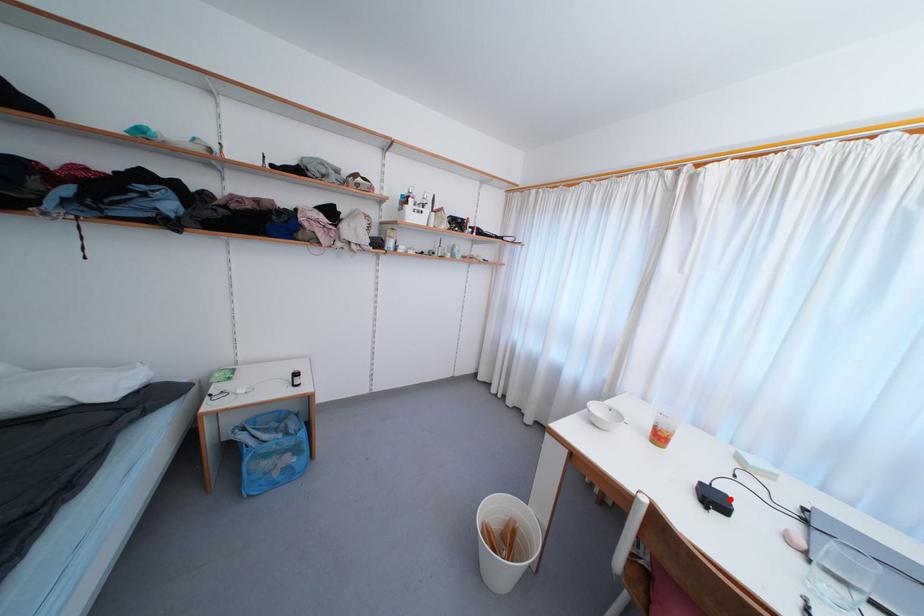
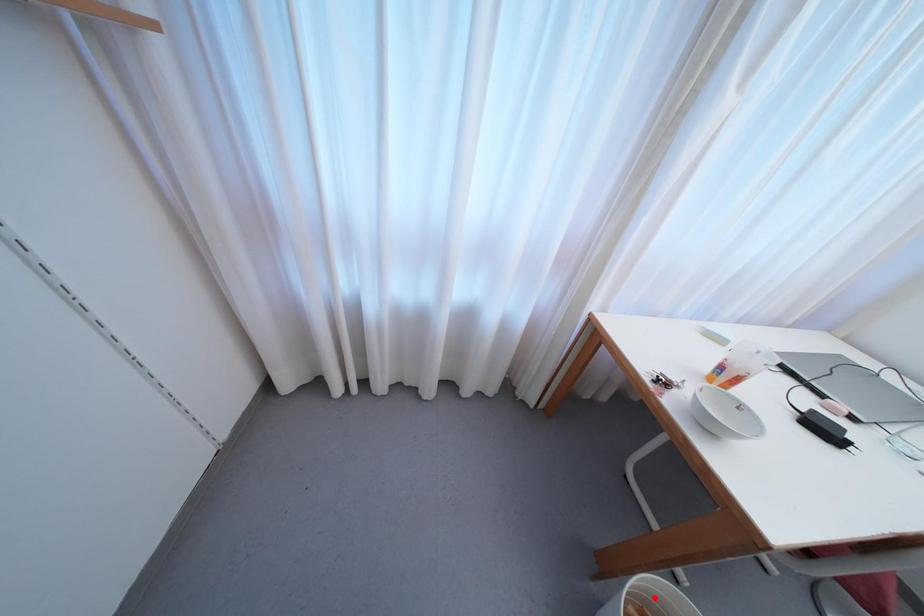
I am providing you with two images of the same scene from different viewpoints. A red point is marked on the first image and another point is marked on the second image. Is the marked point in image1 the same physical position as the marked point in image2?

No